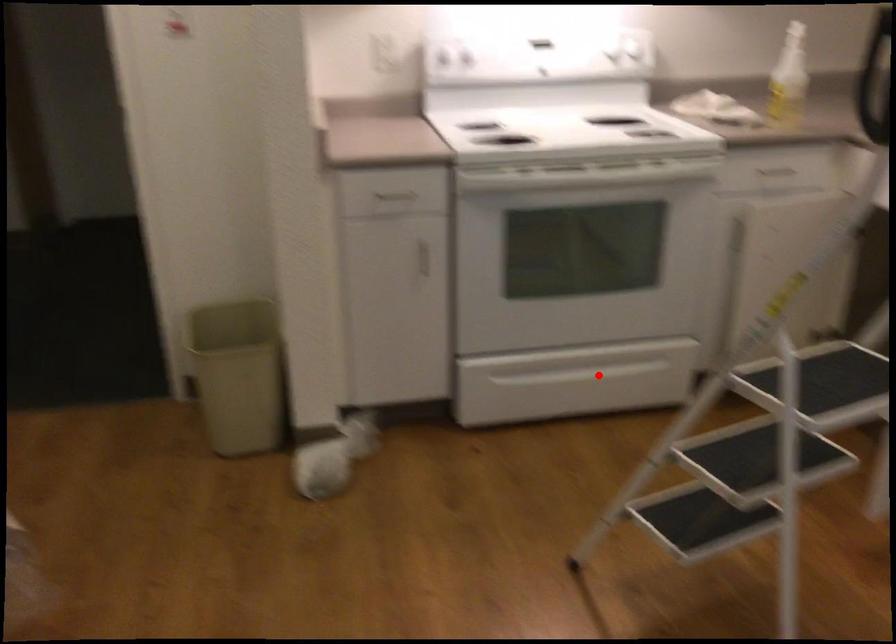
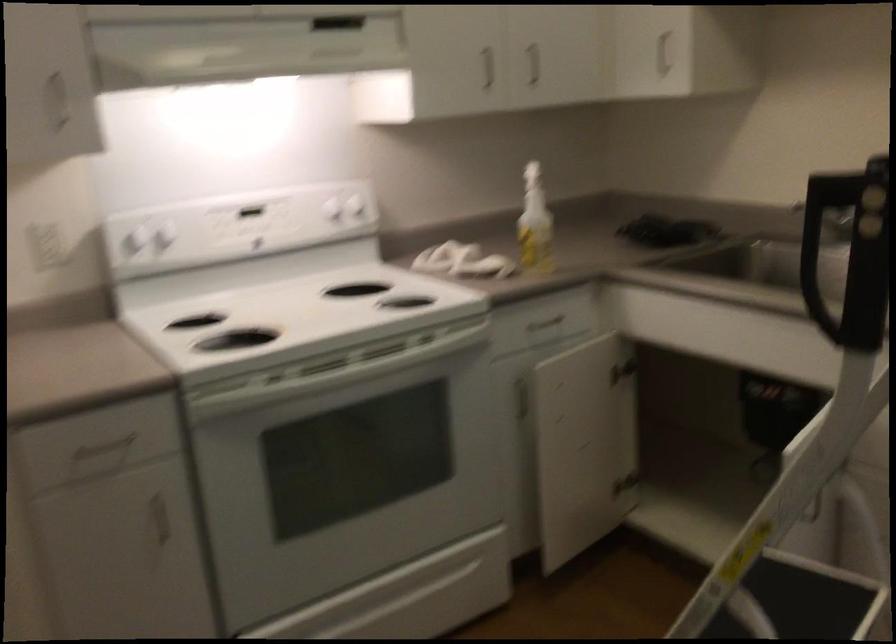
Where in the second image is the point corresponding to the highlighted location from the first image?

(409, 596)